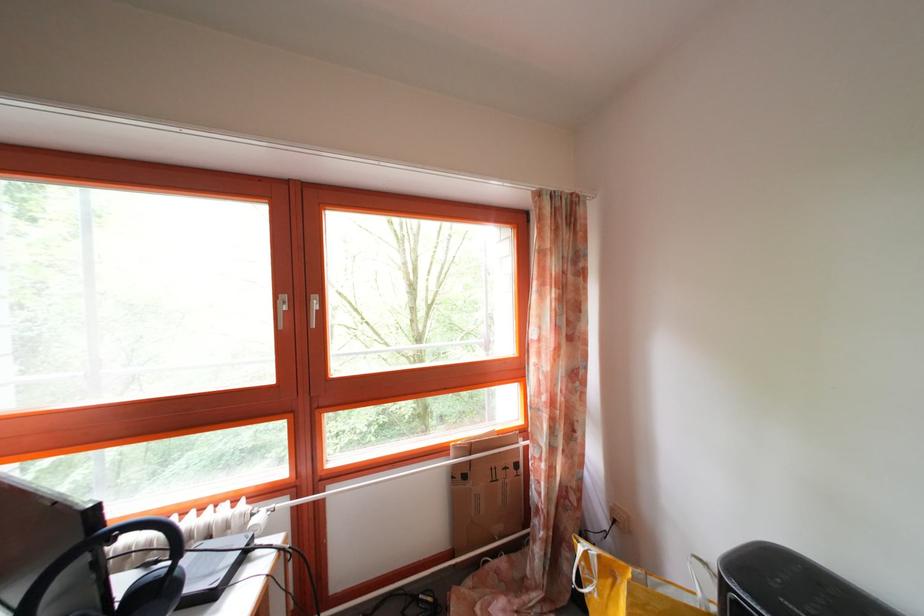
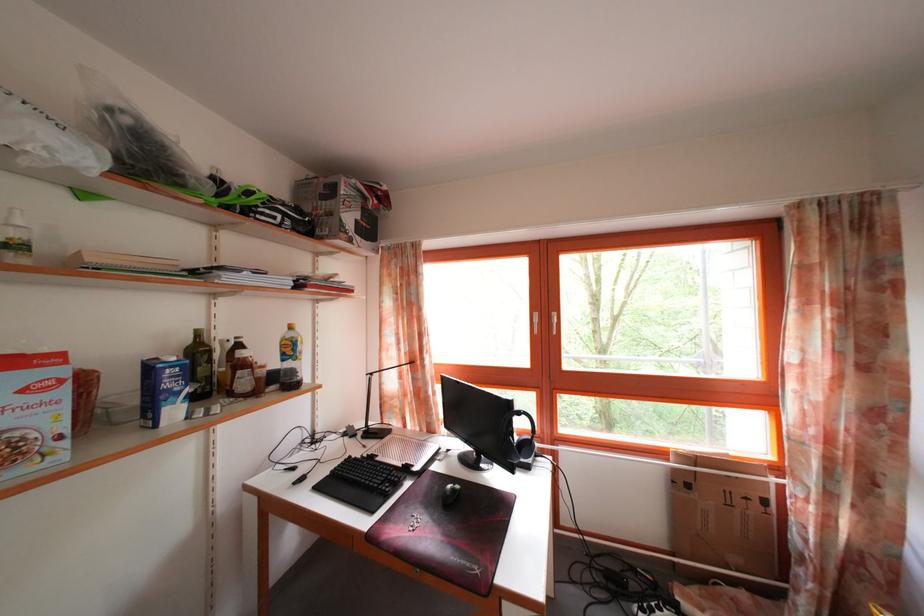
Question: The camera is either moving clockwise (left) or counter-clockwise (right) around the object. The first image is from the beginning of the video and the second image is from the end. Is the camera moving left or right when shooting the video?

Choices:
 (A) Left
 (B) Right

Answer: (B)